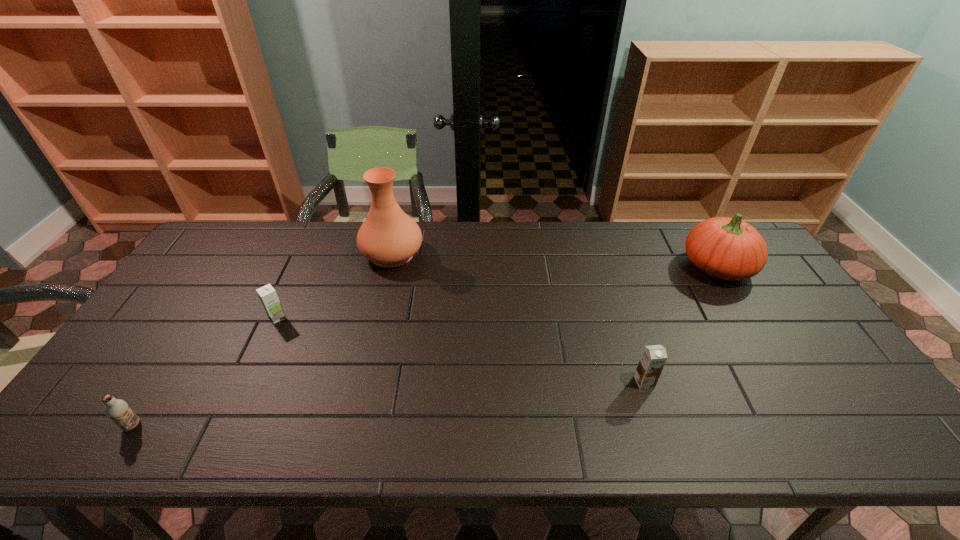
The image size is (960, 540). Find the location of `chocolate milk that is the second closest to the fourth object from right to left`. chocolate milk that is the second closest to the fourth object from right to left is located at coordinates (653, 358).

Locate an element on the screen. The height and width of the screenshot is (540, 960). free space that satisfies the following two spatial constraints: 1. on the back side of the fourth shortest object; 2. on the right side of the second chocolate milk from right to left is located at coordinates (300, 267).

Find the location of a particular element. The image size is (960, 540). vacant space that satisfies the following two spatial constraints: 1. on the back side of the leftmost chocolate milk; 2. on the right side of the vase is located at coordinates (242, 254).